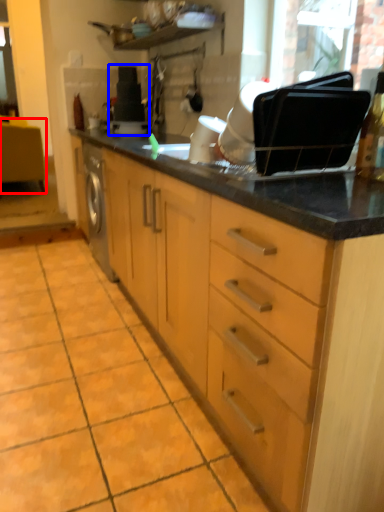
Question: Which of the following is the farthest to the observer, vanity (highlighted by a red box) or appliance (highlighted by a blue box)?

Choices:
 (A) vanity
 (B) appliance

Answer: (A)